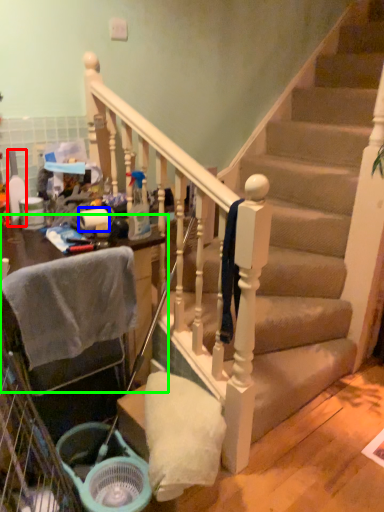
Question: Based on their relative distances, which object is farther from bottle (highlighted by a red box)? Choose from toilet paper (highlighted by a blue box) and furniture (highlighted by a green box).

Choices:
 (A) toilet paper
 (B) furniture

Answer: (B)